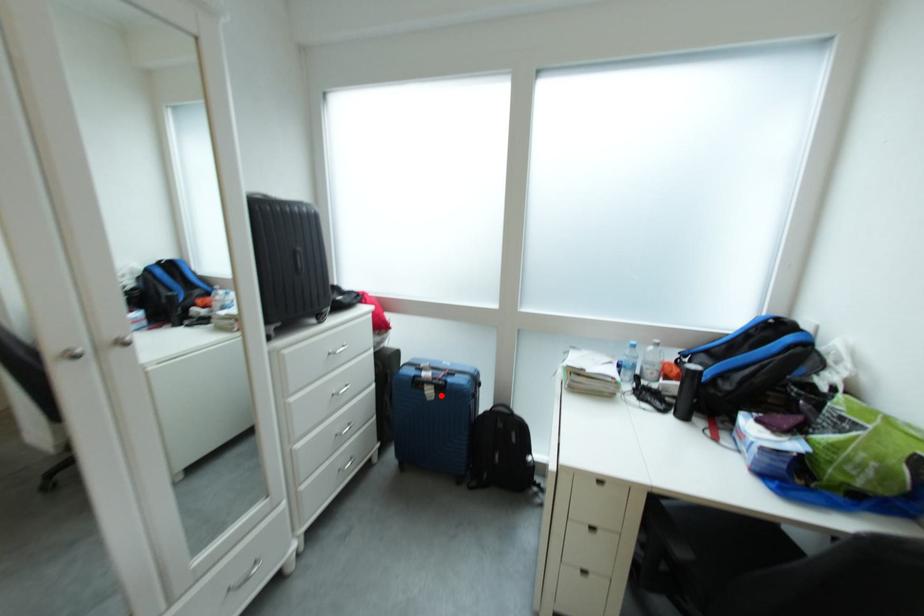
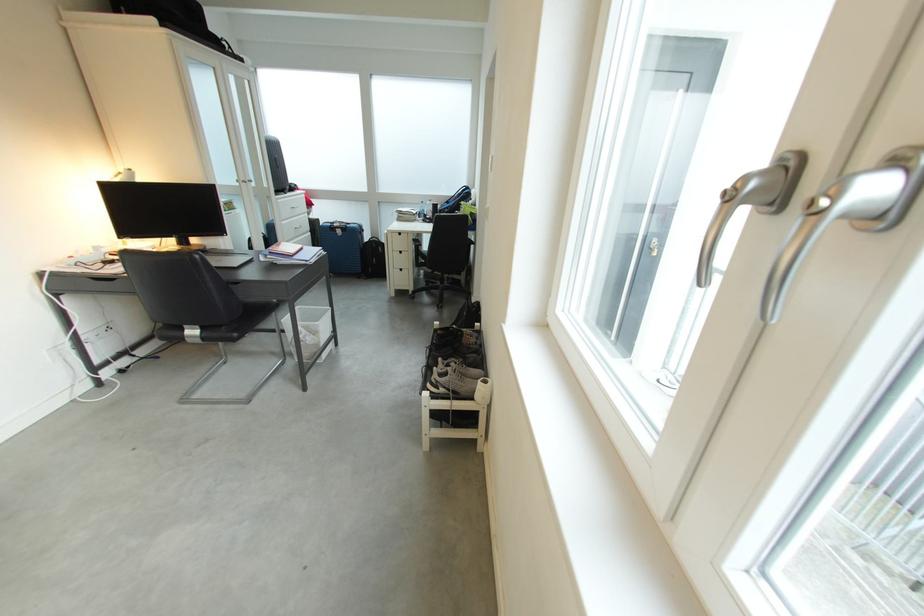
Question: I am providing you with two images of the same scene from different viewpoints. Image1 has a red point marked. In image2, the corresponding 3D location appears at what relative position? Reply with the corresponding letter.

Choices:
 (A) Closer
 (B) Farther

Answer: (A)